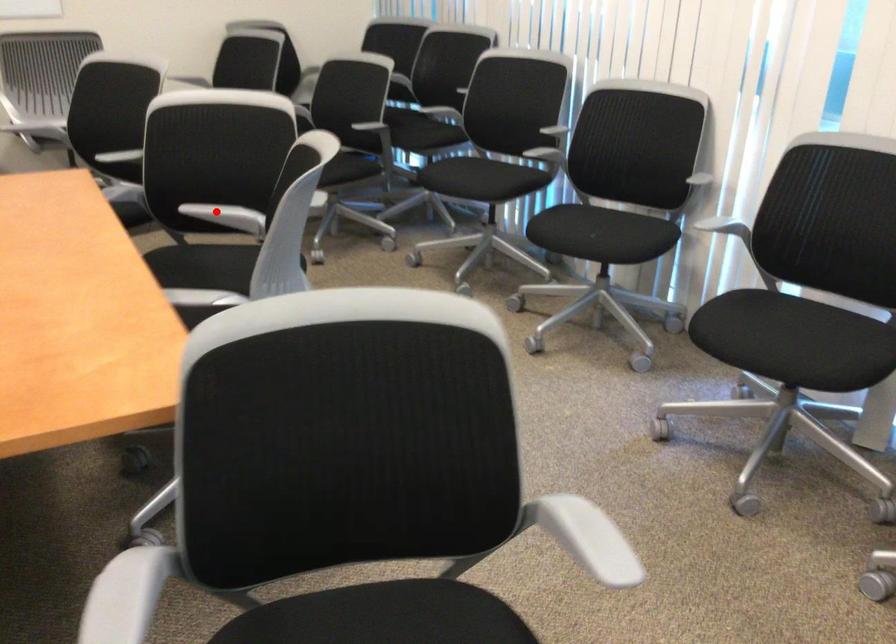
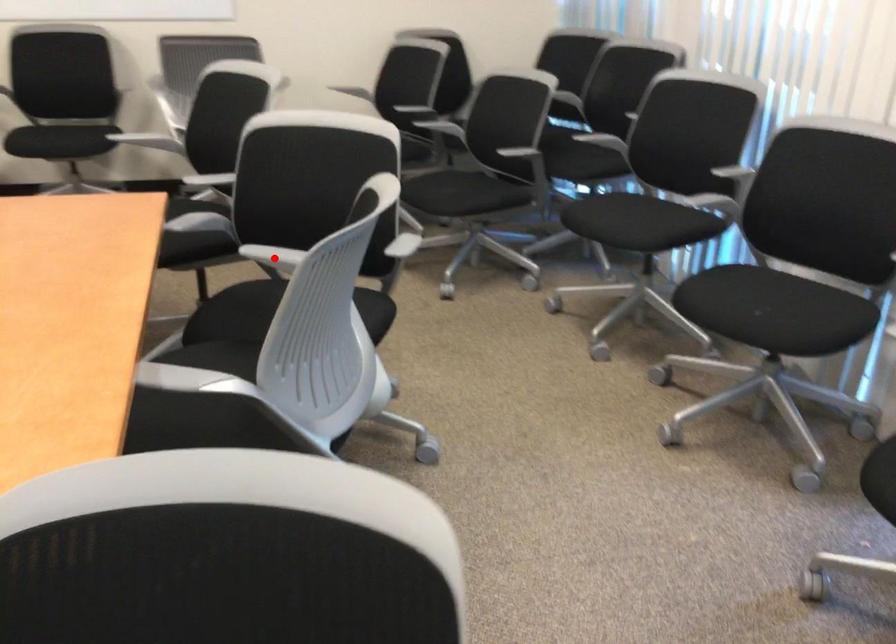
I am providing you with two images of the same scene from different viewpoints. A red point is marked on the first image and another point is marked on the second image. Does the point marked in image1 correspond to the same location as the one in image2?

Yes